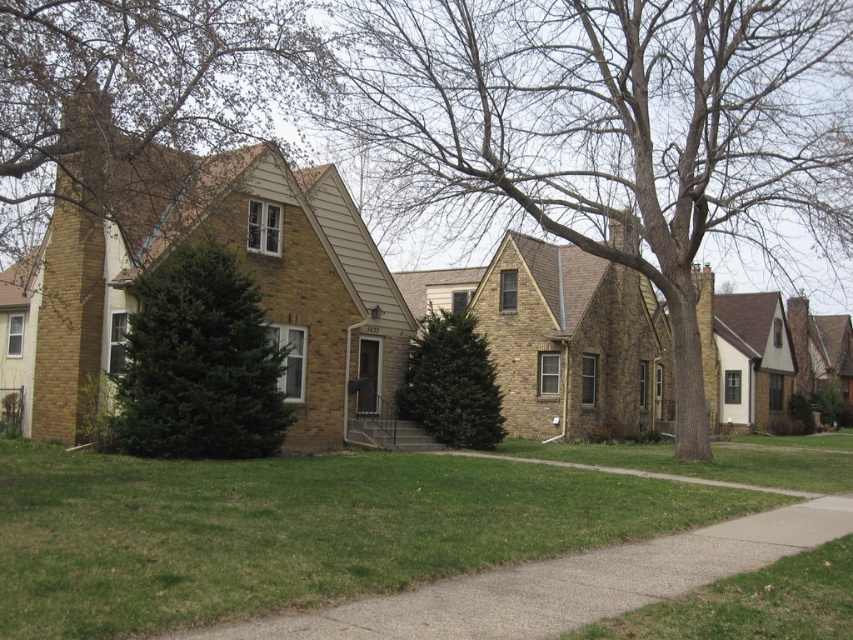
Question: Which point is farther from the camera taking this photo?

Choices:
 (A) (244, 369)
 (B) (759, 528)
 (C) (721, 51)

Answer: (C)

Question: Is brown textured tree at center to the right of green grass at lower right from the viewer's perspective?

Choices:
 (A) yes
 (B) no

Answer: (A)

Question: Which point is closer to the camera?

Choices:
 (A) (33, 124)
 (B) (747, 604)

Answer: (B)

Question: Observing the image, what is the correct spatial positioning of gray concrete sidewalk at lower center in reference to green textured evergreen tree at center?

Choices:
 (A) below
 (B) above

Answer: (A)

Question: Estimate the real-world distances between objects in this image. Which object is farther from the green matte tree at center?

Choices:
 (A) brown textured tree at center
 (B) gray concrete sidewalk at lower center

Answer: (B)

Question: Where is green matte tree at center located in relation to green textured evergreen tree at center in the image?

Choices:
 (A) left
 (B) right

Answer: (A)